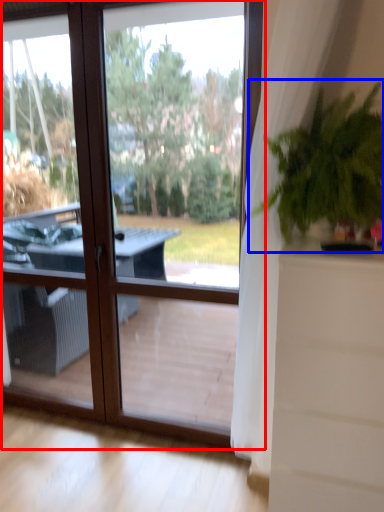
Question: Which of the following is the farthest to the observer, window (highlighted by a red box) or houseplant (highlighted by a blue box)?

Choices:
 (A) window
 (B) houseplant

Answer: (A)